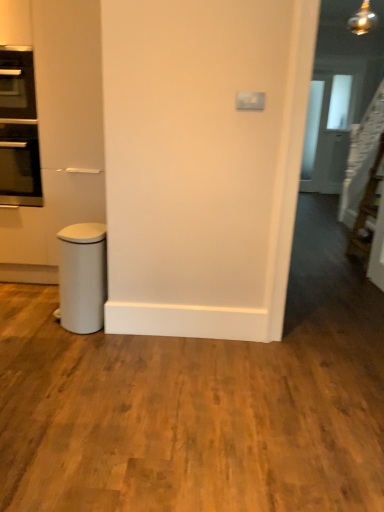
What is the approximate height of black glass oven at left?

black glass oven at left is 46.93 centimeters tall.

Find the location of a particular element. The height and width of the screenshot is (512, 384). black glass oven at left is located at coordinates (17, 84).

This screenshot has width=384, height=512. I want to click on white matte waste bin at lower left, so click(82, 277).

The width and height of the screenshot is (384, 512). What do you see at coordinates (326, 134) in the screenshot?
I see `transparent glass door at upper right` at bounding box center [326, 134].

I want to click on black glass oven at left, so click(x=17, y=84).

Between white matte waste bin at lower left and transparent glass door at upper right, which one appears on the left side from the viewer's perspective?

Positioned to the left is white matte waste bin at lower left.

Is white matte waste bin at lower left bigger or smaller than transparent glass door at upper right?

white matte waste bin at lower left is smaller than transparent glass door at upper right.

Which object is thinner, white matte waste bin at lower left or transparent glass door at upper right?

transparent glass door at upper right.

From a real-world perspective, is white matte waste bin at lower left located higher than transparent glass door at upper right?

No, from a real-world perspective, white matte waste bin at lower left is not above transparent glass door at upper right.

From a real-world perspective, does white matte waste bin at lower left sit lower than black glass oven at left?

Yes, from a real-world perspective, white matte waste bin at lower left is below black glass oven at left.

From the picture: From the image's perspective, is white matte waste bin at lower left beneath black glass oven at left?

Yes, from the image's perspective, white matte waste bin at lower left is beneath black glass oven at left.

How many degrees apart are the facing directions of white matte waste bin at lower left and black glass oven at left?

They differ by 90.1 degrees in their facing directions.

Who is bigger, transparent glass door at upper right or white matte waste bin at lower left?

Bigger between the two is transparent glass door at upper right.

Between transparent glass door at upper right and white matte waste bin at lower left, which one is positioned in front?

white matte waste bin at lower left is closer to the camera.

Which is closer, (327,130) or (101,303)?

Point (327,130) is farther from the camera than point (101,303).

Is transparent glass door at upper right aimed at white matte waste bin at lower left?

No, transparent glass door at upper right does not turn towards white matte waste bin at lower left.

Between black glass oven at left and transparent glass door at upper right, which one has more height?

Standing taller between the two is transparent glass door at upper right.

From the picture: Does black glass oven at left have a larger size compared to transparent glass door at upper right?

Incorrect, black glass oven at left is not larger than transparent glass door at upper right.

Is black glass oven at left thinner than transparent glass door at upper right?

In fact, black glass oven at left might be wider than transparent glass door at upper right.

Are black glass oven at left and transparent glass door at upper right making contact?

black glass oven at left and transparent glass door at upper right are not in contact.

Is black glass oven at left at the back of transparent glass door at upper right?

transparent glass door at upper right is not turned away from black glass oven at left.

Is black glass oven at left surrounded by transparent glass door at upper right?

No.

How far apart are transparent glass door at upper right and black glass oven at left?

transparent glass door at upper right is 14.93 feet away from black glass oven at left.

Locate an element on the screen. home appliance that is above the transparent glass door at upper right (from a real-world perspective) is located at coordinates (17, 84).

Which is behind, point (7, 62) or point (104, 227)?

Point (7, 62)

Between black glass oven at left and white matte waste bin at lower left, which one has smaller width?

Thinner between the two is white matte waste bin at lower left.

Which object is positioned more to the right, black glass oven at left or white matte waste bin at lower left?

Positioned to the right is white matte waste bin at lower left.

Relative to white matte waste bin at lower left, is black glass oven at left in front or behind?

In the image, black glass oven at left appears behind white matte waste bin at lower left.

This screenshot has width=384, height=512. In order to click on waste container on the left of transparent glass door at upper right in this screenshot , I will do `click(82, 277)`.

Locate an element on the screen. waste container that appears on the right of black glass oven at left is located at coordinates (82, 277).

Which object lies nearer to the anchor point white matte waste bin at lower left, transparent glass door at upper right or black glass oven at left?

The object closer to white matte waste bin at lower left is black glass oven at left.

Considering their positions, is black glass oven at left positioned closer to transparent glass door at upper right than white matte waste bin at lower left?

black glass oven at left is positioned closer to the anchor transparent glass door at upper right.

Estimate the real-world distances between objects in this image. Which object is closer to white matte waste bin at lower left, black glass oven at left or transparent glass door at upper right?

black glass oven at left is closer to white matte waste bin at lower left.

Which object lies further to the anchor point transparent glass door at upper right, white matte waste bin at lower left or black glass oven at left?

white matte waste bin at lower left lies further to transparent glass door at upper right than the other object.

Looking at the image, which one is located further to black glass oven at left, white matte waste bin at lower left or transparent glass door at upper right?

Among the two, transparent glass door at upper right is located further to black glass oven at left.

Considering their positions, is transparent glass door at upper right positioned further to black glass oven at left than white matte waste bin at lower left?

transparent glass door at upper right is positioned further to the anchor black glass oven at left.

Where is `home appliance positioned between white matte waste bin at lower left and transparent glass door at upper right from near to far`? home appliance positioned between white matte waste bin at lower left and transparent glass door at upper right from near to far is located at coordinates (17, 84).